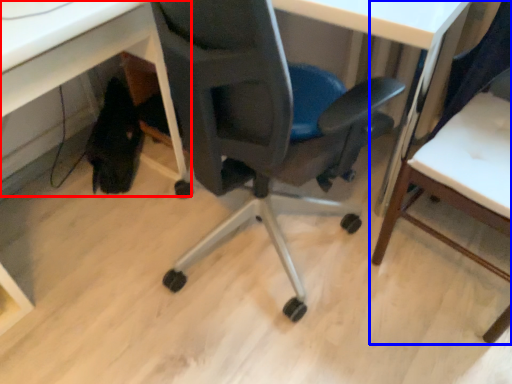
Question: Among these objects, which one is nearest to the camera, computer desk (highlighted by a red box) or chair (highlighted by a blue box)?

Choices:
 (A) computer desk
 (B) chair

Answer: (B)